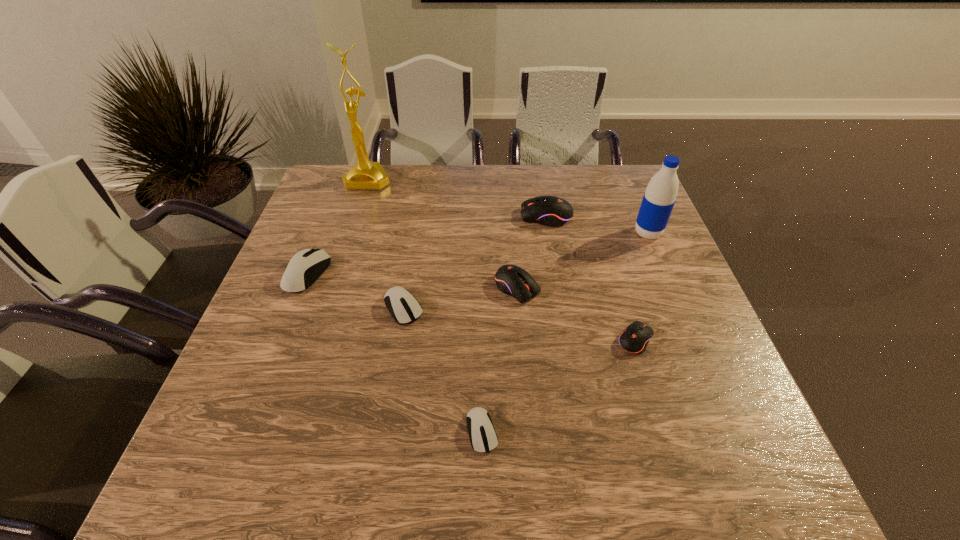
At what (x,y) coordinates should I click in order to perform the action: click on object at the far left corner. Please return your answer as a coordinate pair (x, y). Looking at the image, I should click on (368, 175).

In the image, there is a desktop. Where is `vacant space at the far edge`? Image resolution: width=960 pixels, height=540 pixels. vacant space at the far edge is located at coordinates (494, 192).

Identify the location of blank space at the left edge of the desktop. This screenshot has width=960, height=540. (333, 274).

Locate an element on the screen. The width and height of the screenshot is (960, 540). vacant space at the right edge of the desktop is located at coordinates (648, 309).

The image size is (960, 540). I want to click on free space between the second biggest white mouse and the leftmost mouse, so click(x=355, y=291).

This screenshot has height=540, width=960. I want to click on unoccupied area between the biggest white mouse and the farthest object, so click(338, 227).

Where is `empty space between the farthest object and the second white mouse from right to left`? The width and height of the screenshot is (960, 540). empty space between the farthest object and the second white mouse from right to left is located at coordinates (386, 244).

What are the coordinates of `free spot between the second biggest black computer mouse and the second white mouse from left to right` in the screenshot? It's located at [461, 298].

Where is `empty location between the shortest object and the leftmost mouse`? This screenshot has width=960, height=540. empty location between the shortest object and the leftmost mouse is located at coordinates (395, 353).

Where is `free spot between the award and the fourth object from left to right`? The image size is (960, 540). free spot between the award and the fourth object from left to right is located at coordinates (425, 305).